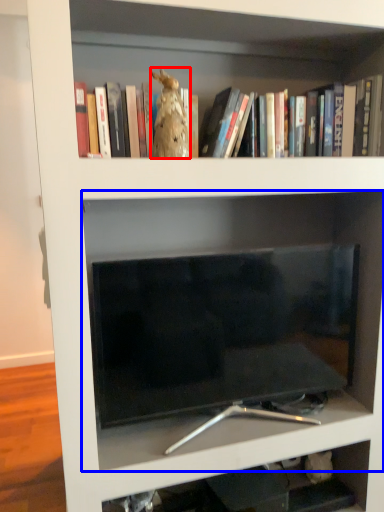
Question: Which of the following is the closest to the observer, animal (highlighted by a red box) or shelf (highlighted by a blue box)?

Choices:
 (A) animal
 (B) shelf

Answer: (A)